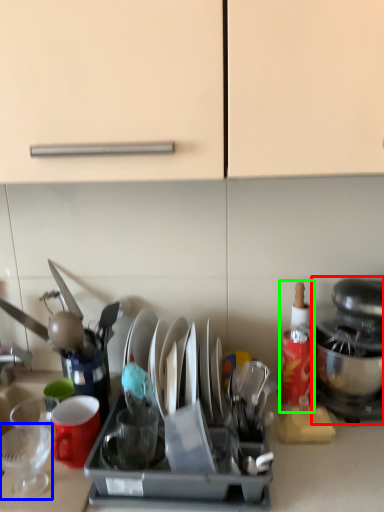
Question: Which object is positioned closest to kitchen appliance (highlighted by a red box)? Select from tableware (highlighted by a blue box) and bottle (highlighted by a green box).

Choices:
 (A) tableware
 (B) bottle

Answer: (B)